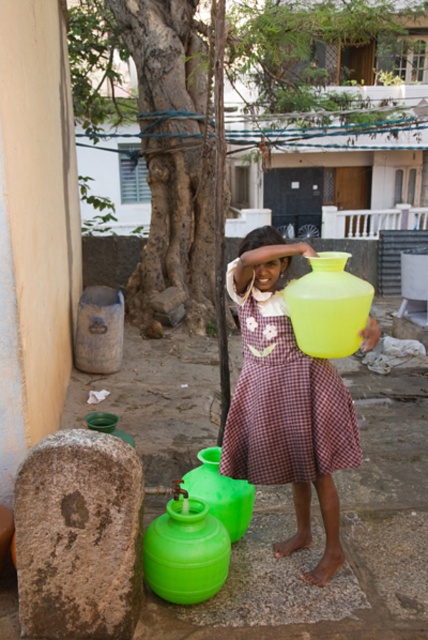
Is brown checkered dress at center taller than matte brown hair at center?

Yes, brown checkered dress at center is taller than matte brown hair at center.

Between point (232, 468) and point (282, 243), which one is positioned behind?

The point (232, 468) is behind.

Where is `brown checkered dress at center`? The height and width of the screenshot is (640, 428). brown checkered dress at center is located at coordinates (284, 403).